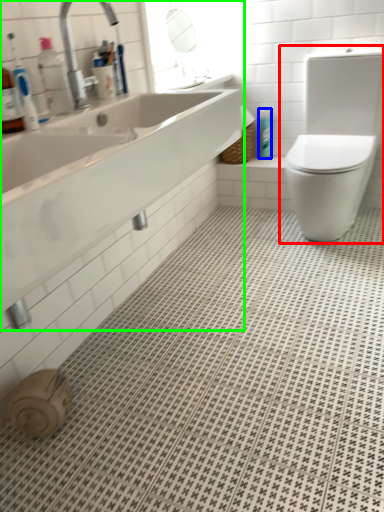
Question: Estimate the real-world distances between objects in this image. Which object is closer to toilet (highlighted by a red box), toiletry (highlighted by a blue box) or sink (highlighted by a green box)?

Choices:
 (A) toiletry
 (B) sink

Answer: (A)